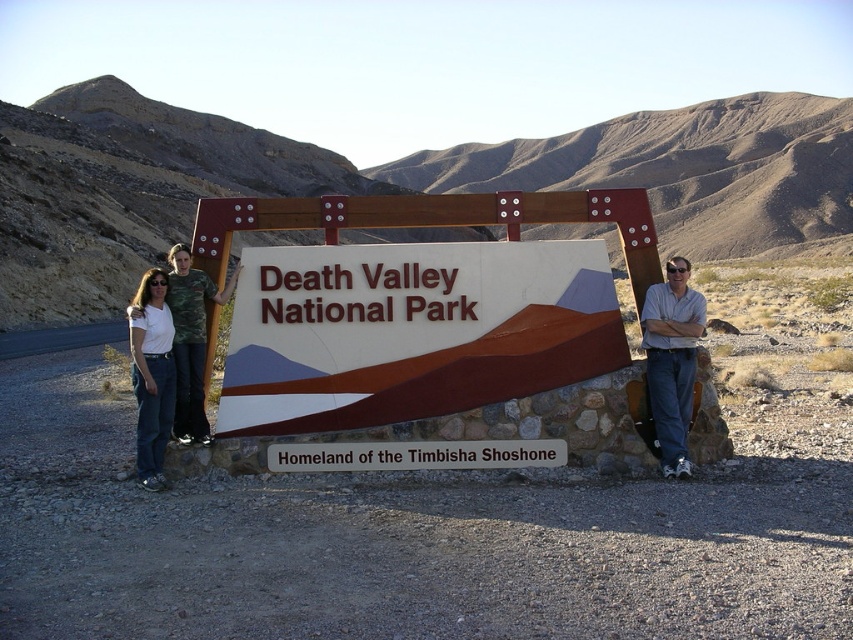
Question: Where is matte plastic sign at center located in relation to white cotton shirt at left in the image?

Choices:
 (A) left
 (B) right

Answer: (B)

Question: Does white cotton shirt at left appear under white matte shirt at left?

Choices:
 (A) no
 (B) yes

Answer: (A)

Question: Can you confirm if white cotton shirt at left is smaller than light blue denim jeans at center?

Choices:
 (A) yes
 (B) no

Answer: (A)

Question: Among these objects, which one is nearest to the camera?

Choices:
 (A) matte plastic sign at center
 (B) light blue denim jeans at center
 (C) white cotton shirt at left

Answer: (C)

Question: Which point is farther from the camera taking this photo?

Choices:
 (A) (685, 276)
 (B) (154, 412)
 (C) (155, 385)
 (D) (244, 323)

Answer: (A)

Question: Estimate the real-world distances between objects in this image. Which object is closer to the matte plastic sign at center?

Choices:
 (A) light blue denim jeans at center
 (B) white matte shirt at left

Answer: (A)